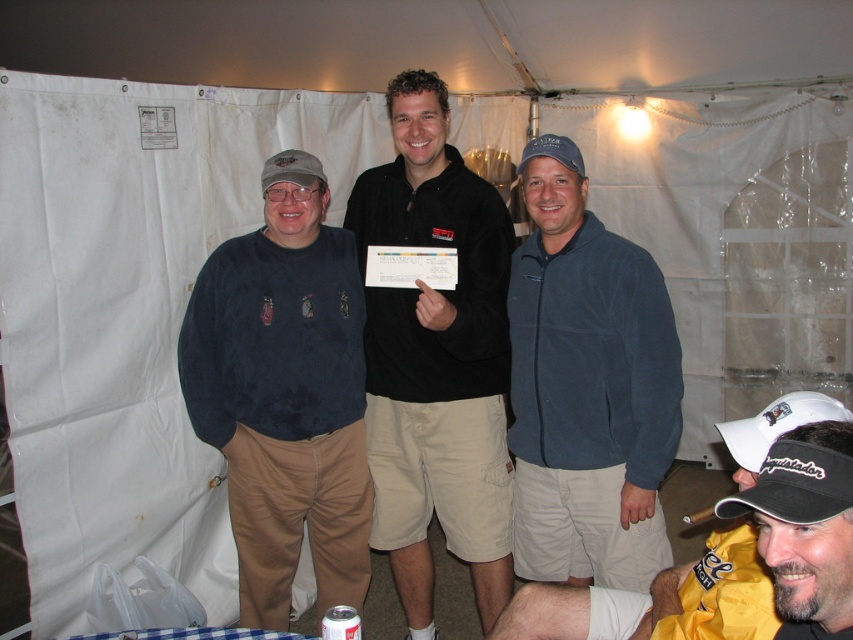
Can you confirm if black fleece jacket at center is positioned below black cap at lower right?

Incorrect, black fleece jacket at center is not positioned below black cap at lower right.

Between point (509, 595) and point (735, 512), which one is positioned behind?

The point (509, 595) is more distant.

The image size is (853, 640). Identify the location of black fleece jacket at center. (436, 360).

Between dark blue fleece at center and black fleece jacket at center, which one has less height?

dark blue fleece at center

Can you confirm if dark blue fleece at center is positioned below black fleece jacket at center?

Correct, dark blue fleece at center is located below black fleece jacket at center.

Which is in front, point (314, 502) or point (459, 557)?

Point (459, 557) is more forward.

Find the location of a particular element. This screenshot has height=640, width=853. dark blue fleece at center is located at coordinates (285, 394).

Which is behind, point (192, 324) or point (593, 598)?

The point (192, 324) is behind.

Which is below, dark blue fleece at center or yellow fabric jacket at lower right?

yellow fabric jacket at lower right is lower down.

Between point (260, 579) and point (811, 435), which one is positioned in front?

Positioned in front is point (811, 435).

Find the location of a particular element. Image resolution: width=853 pixels, height=640 pixels. dark blue fleece at center is located at coordinates (285, 394).